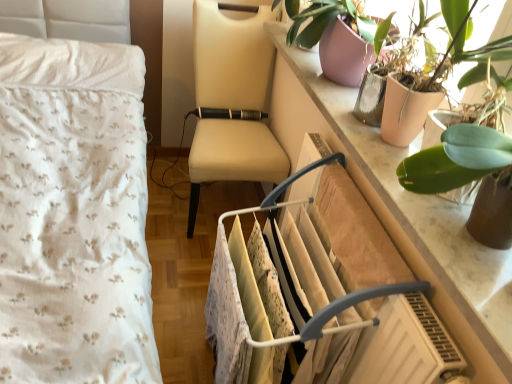
Question: Should I look upward or downward to see white plastic clothes rack at center?

Choices:
 (A) down
 (B) up

Answer: (A)

Question: Does beige leather chair at center have a greater width compared to marble counter top at upper right?

Choices:
 (A) no
 (B) yes

Answer: (B)

Question: Are beige leather chair at center and marble counter top at upper right located far from each other?

Choices:
 (A) no
 (B) yes

Answer: (A)

Question: Could you tell me if beige leather chair at center is facing marble counter top at upper right?

Choices:
 (A) no
 (B) yes

Answer: (B)

Question: From a real-world perspective, is beige leather chair at center on top of marble counter top at upper right?

Choices:
 (A) no
 (B) yes

Answer: (A)

Question: Is beige leather chair at center turned away from marble counter top at upper right?

Choices:
 (A) no
 (B) yes

Answer: (A)

Question: Is beige leather chair at center in front of marble counter top at upper right?

Choices:
 (A) no
 (B) yes

Answer: (A)

Question: Does white plastic clothes rack at center have a smaller size compared to beige leather chair at center?

Choices:
 (A) yes
 (B) no

Answer: (A)

Question: Considering the relative sizes of white plastic clothes rack at center and beige leather chair at center in the image provided, is white plastic clothes rack at center bigger than beige leather chair at center?

Choices:
 (A) yes
 (B) no

Answer: (B)

Question: Can you confirm if white plastic clothes rack at center is thinner than beige leather chair at center?

Choices:
 (A) yes
 (B) no

Answer: (A)

Question: Is white plastic clothes rack at center outside beige leather chair at center?

Choices:
 (A) no
 (B) yes

Answer: (B)

Question: Is white plastic clothes rack at center beside beige leather chair at center?

Choices:
 (A) yes
 (B) no

Answer: (B)

Question: Is white plastic clothes rack at center positioned in front of beige leather chair at center?

Choices:
 (A) yes
 (B) no

Answer: (A)

Question: Is white plastic clothes rack at center outside green leafy plant at upper right, the first houseplant in the front-to-back sequence?

Choices:
 (A) no
 (B) yes

Answer: (B)